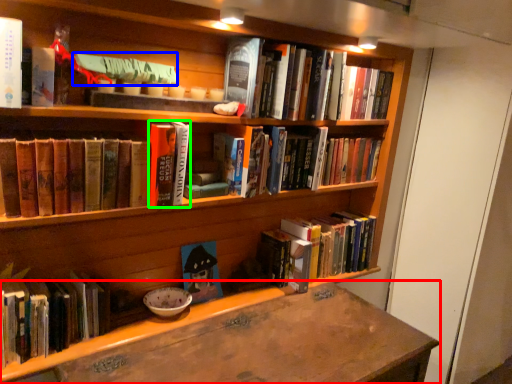
Question: Considering the real-world distances, which object is closest to desk (highlighted by a red box)? book (highlighted by a blue box) or book (highlighted by a green box).

Choices:
 (A) book
 (B) book

Answer: (B)